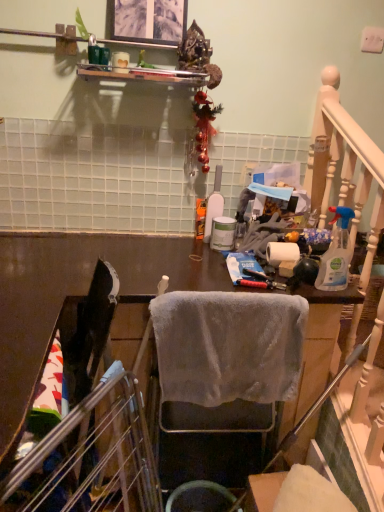
Describe the element at coordinates (198, 55) in the screenshot. I see `metallic gold ornament at upper center` at that location.

What is the approximate height of clear plastic spray bottle at right, marked as the second bottle in a back-to-front arrangement?

clear plastic spray bottle at right, marked as the second bottle in a back-to-front arrangement, is 11.19 inches tall.

Looking at this image, measure the distance between point (168, 347) and camera.

The depth of point (168, 347) is 3.92 feet.

Where is `white matte bottle at center, arranged as the 2th bottle when viewed from the front`? Image resolution: width=384 pixels, height=512 pixels. white matte bottle at center, arranged as the 2th bottle when viewed from the front is located at coordinates (214, 204).

Is clear plastic spray bottle at right, which ranks as the first bottle in right-to-left order, beside metallic gold ornament at upper center?

No, clear plastic spray bottle at right, which ranks as the first bottle in right-to-left order, is not in contact with metallic gold ornament at upper center.

The image size is (384, 512). I want to click on christmas decoration on the left of clear plastic spray bottle at right, which ranks as the first bottle in front-to-back order, so 198,55.

Which object is further away from the camera, clear plastic spray bottle at right, marked as the second bottle in a back-to-front arrangement, or metallic gold ornament at upper center?

metallic gold ornament at upper center is behind.

Looking at this image, is white matte bottle at center, the 1th bottle positioned from the left, far from metallic silver picture frame at upper center?

No.

Does white matte bottle at center, acting as the 2th bottle starting from the right, turn towards metallic silver picture frame at upper center?

No, white matte bottle at center, acting as the 2th bottle starting from the right, does not turn towards metallic silver picture frame at upper center.

Looking at the image, does white matte bottle at center, arranged as the 2th bottle when viewed from the front, seem bigger or smaller compared to metallic silver picture frame at upper center?

In the image, white matte bottle at center, arranged as the 2th bottle when viewed from the front, appears to be larger than metallic silver picture frame at upper center.

Consider the image. Which of these two, white matte bottle at center, acting as the 2th bottle starting from the right, or metallic silver picture frame at upper center, stands taller?

With more height is white matte bottle at center, acting as the 2th bottle starting from the right.

In the image, is gray fabric chair at center on the left side or the right side of metallic gold ornament at upper center?

gray fabric chair at center is positioned on metallic gold ornament at upper center's right side.

Is gray fabric chair at center positioned far away from metallic gold ornament at upper center?

No, there isn't a large distance between gray fabric chair at center and metallic gold ornament at upper center.

Image resolution: width=384 pixels, height=512 pixels. I want to click on chair that is below the metallic gold ornament at upper center (from the image's perspective), so click(223, 377).

Considering the relative sizes of gray fabric chair at center and metallic gold ornament at upper center in the image provided, is gray fabric chair at center shorter than metallic gold ornament at upper center?

No, gray fabric chair at center is not shorter than metallic gold ornament at upper center.

Considering the sizes of objects gray fabric chair at center and white matte toilet paper at center in the image provided, who is taller, gray fabric chair at center or white matte toilet paper at center?

Standing taller between the two is gray fabric chair at center.

Looking at their sizes, would you say gray fabric chair at center is wider or thinner than white matte toilet paper at center?

Considering their sizes, gray fabric chair at center looks broader than white matte toilet paper at center.

Where is `chair that appears on the left of white matte toilet paper at center`? chair that appears on the left of white matte toilet paper at center is located at coordinates click(x=223, y=377).

Looking at this image, can we say gray fabric chair at center lies outside white matte toilet paper at center?

Yes.

In the scene shown: Is metallic silver picture frame at upper center positioned with its back to gray fabric chair at center?

metallic silver picture frame at upper center is not turned away from gray fabric chair at center.

From the image's perspective, between metallic silver picture frame at upper center and gray fabric chair at center, which one is located above?

metallic silver picture frame at upper center is shown above in the image.

How distant is metallic silver picture frame at upper center from gray fabric chair at center?

3.84 feet.

Is metallic gold ornament at upper center oriented away from white matte toilet paper at center?

No, white matte toilet paper at center is not at the back of metallic gold ornament at upper center.

Is metallic gold ornament at upper center situated inside white matte toilet paper at center or outside?

metallic gold ornament at upper center is not inside white matte toilet paper at center, it's outside.

From a real-world perspective, who is located higher, metallic gold ornament at upper center or white matte toilet paper at center?

In real-world perspective, metallic gold ornament at upper center is above.

From the image's perspective, is metallic gold ornament at upper center above white matte toilet paper at center?

Indeed, from the image's perspective, metallic gold ornament at upper center is shown above white matte toilet paper at center.

Considering the relative positions of white matte bottle at center, the 1th bottle positioned from the back, and metallic gold ornament at upper center in the image provided, is white matte bottle at center, the 1th bottle positioned from the back, behind metallic gold ornament at upper center?

Yes, it is behind metallic gold ornament at upper center.

Is white matte bottle at center, acting as the 2th bottle starting from the right, turned away from metallic gold ornament at upper center?

white matte bottle at center, acting as the 2th bottle starting from the right, is not turned away from metallic gold ornament at upper center.

Which of these two, white matte bottle at center, arranged as the 2th bottle when viewed from the front, or metallic gold ornament at upper center, stands shorter?

With less height is white matte bottle at center, arranged as the 2th bottle when viewed from the front.

Would you say white matte bottle at center, arranged as the 2th bottle when viewed from the front, is outside metallic gold ornament at upper center?

That's correct, white matte bottle at center, arranged as the 2th bottle when viewed from the front, is outside of metallic gold ornament at upper center.

From a real-world perspective, which bottle is the 2nd one underneath the metallic gold ornament at upper center? Please provide its 2D coordinates.

[(336, 253)]

The height and width of the screenshot is (512, 384). In order to click on picture frame located in front of the white matte bottle at center, acting as the 2th bottle starting from the right in this screenshot , I will do `click(149, 21)`.

Based on their spatial positions, is metallic silver picture frame at upper center or gray fabric chair at center closer to white matte toilet paper at center?

gray fabric chair at center lies closer to white matte toilet paper at center than the other object.

From the picture: Estimate the real-world distances between objects in this image. Which object is closer to clear plastic spray bottle at right, marked as the second bottle in a back-to-front arrangement, white matte bottle at center, arranged as the 2th bottle when viewed from the front, or metallic gold ornament at upper center?

white matte bottle at center, arranged as the 2th bottle when viewed from the front.

From the image, which object appears to be farther from clear plastic spray bottle at right, marked as the second bottle in a back-to-front arrangement, metallic silver picture frame at upper center or gray fabric chair at center?

Based on the image, metallic silver picture frame at upper center appears to be further to clear plastic spray bottle at right, marked as the second bottle in a back-to-front arrangement.

Which object lies nearer to the anchor point white matte toilet paper at center, gray fabric chair at center or metallic gold ornament at upper center?

gray fabric chair at center lies closer to white matte toilet paper at center than the other object.

Based on their spatial positions, is metallic silver picture frame at upper center or metallic gold ornament at upper center closer to gray fabric chair at center?

Answer: metallic gold ornament at upper center is closer to gray fabric chair at center.

From the image, which object appears to be nearer to gray fabric chair at center, metallic gold ornament at upper center or white matte toilet paper at center?

white matte toilet paper at center lies closer to gray fabric chair at center than the other object.

From the image, which object appears to be farther from clear plastic spray bottle at right, which ranks as the first bottle in right-to-left order, white matte toilet paper at center or gray fabric chair at center?

Based on the image, gray fabric chair at center appears to be further to clear plastic spray bottle at right, which ranks as the first bottle in right-to-left order.

Based on their spatial positions, is gray fabric chair at center or white matte bottle at center, acting as the 2th bottle starting from the right, further from clear plastic spray bottle at right, marked as the second bottle in a back-to-front arrangement?

The object further to clear plastic spray bottle at right, marked as the second bottle in a back-to-front arrangement, is white matte bottle at center, acting as the 2th bottle starting from the right.

You are a GUI agent. You are given a task and a screenshot of the screen. Output one action in this format:
    pyautogui.click(x=<x>, y=<y>)
    Task: Click on the bottle between metallic gold ornament at upper center and clear plastic spray bottle at right, which ranks as the first bottle in front-to-back order, vertically
    
    Given the screenshot: What is the action you would take?
    pyautogui.click(x=214, y=204)

The image size is (384, 512). I want to click on bottle between white matte bottle at center, the 1th bottle positioned from the back, and gray fabric chair at center in the up-down direction, so point(336,253).

Where is `christmas decoration that lies between metallic silver picture frame at upper center and clear plastic spray bottle at right, marked as the second bottle in a back-to-front arrangement, from top to bottom`? Image resolution: width=384 pixels, height=512 pixels. christmas decoration that lies between metallic silver picture frame at upper center and clear plastic spray bottle at right, marked as the second bottle in a back-to-front arrangement, from top to bottom is located at coordinates coord(198,55).

In order to click on toilet paper that lies between metallic gold ornament at upper center and gray fabric chair at center from top to bottom in this screenshot , I will do `click(282, 253)`.